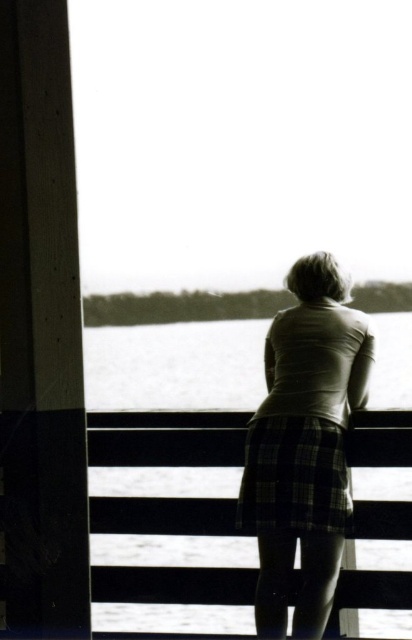
From the picture: Which is below, plaid skirt at center or black plaid skirt at center?

black plaid skirt at center is lower down.

Who is positioned more to the left, plaid skirt at center or black plaid skirt at center?

From the viewer's perspective, black plaid skirt at center appears more on the left side.

The height and width of the screenshot is (640, 412). What are the coordinates of `plaid skirt at center` in the screenshot? It's located at (304, 445).